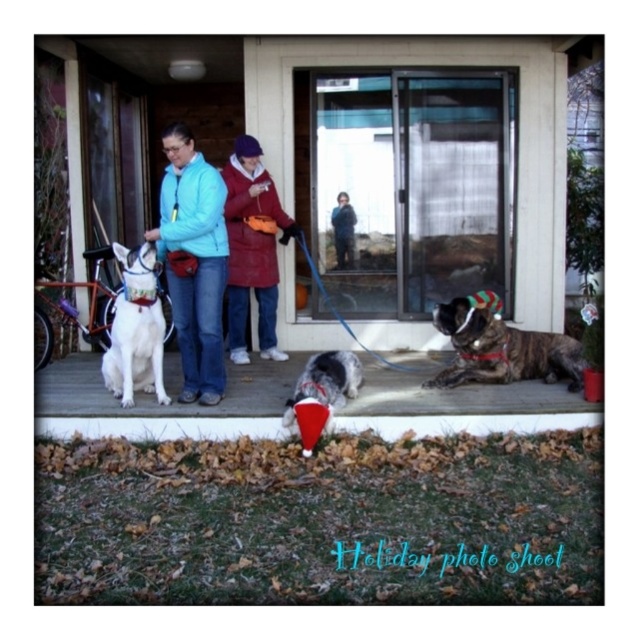
You are a GUI agent. You are given a task and a screenshot of the screen. Output one action in this format:
    pyautogui.click(x=<x>, y=<y>)
    Task: Click on the red woolen sweater at center
    This screenshot has width=638, height=640.
    Given the screenshot: What is the action you would take?
    pyautogui.click(x=253, y=248)

Is point (234, 145) more distant than point (339, 248)?

Yes, it is.

Between point (226, 221) and point (350, 253), which one is positioned in front?

Point (226, 221)

The image size is (638, 640). Find the location of `red woolen sweater at center`. red woolen sweater at center is located at coordinates (253, 248).

Can you confirm if red woolen sweater at center is positioned below soft gray fur at center?

Actually, red woolen sweater at center is above soft gray fur at center.

Does point (258, 170) come behind point (320, 419)?

Yes, point (258, 170) is behind point (320, 419).

Is point (251, 148) farther from viewer compared to point (313, 440)?

Yes, point (251, 148) is farther from viewer.

Find the location of a particular element. red woolen sweater at center is located at coordinates (253, 248).

Is white fabric dog at center above brindle fur dog at lower right?

Incorrect, white fabric dog at center is not positioned above brindle fur dog at lower right.

Is point (234, 403) positioned behind point (470, 362)?

No.

The width and height of the screenshot is (638, 640). In order to click on white fabric dog at center in this screenshot , I will do `click(161, 406)`.